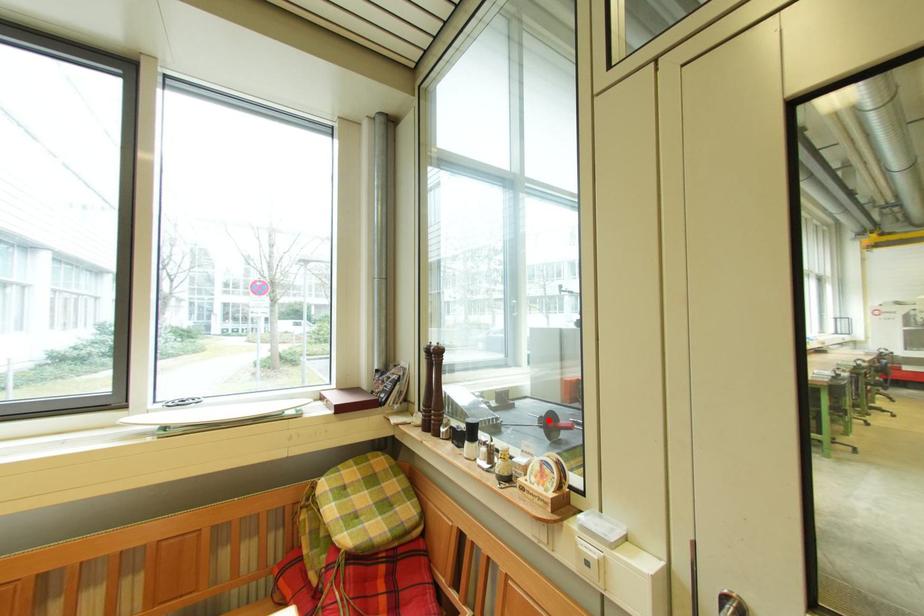
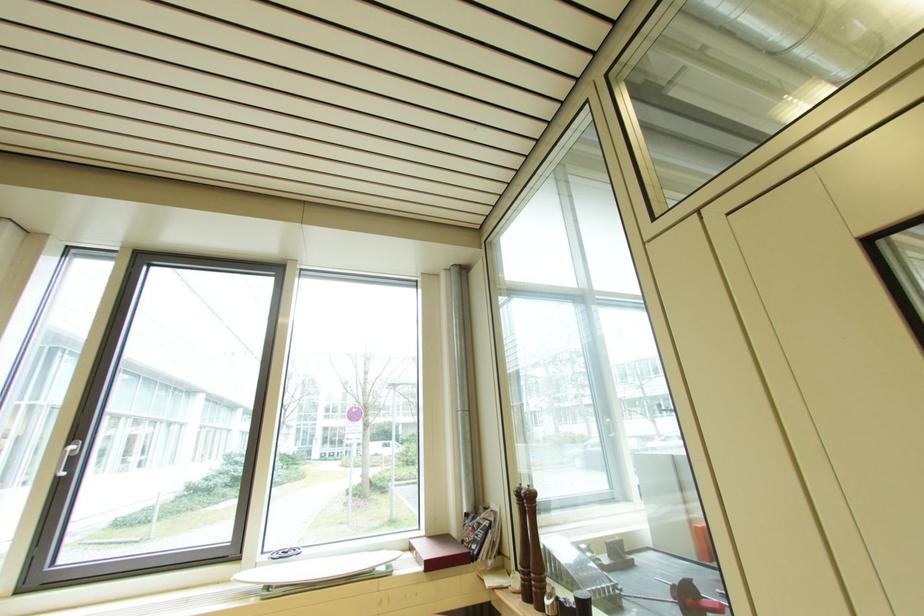
Question: I am providing you with two images of the same scene from different viewpoints. A red point is marked on the first image. Can you still see the location of the red point in image 2?

Choices:
 (A) Yes
 (B) No

Answer: (A)